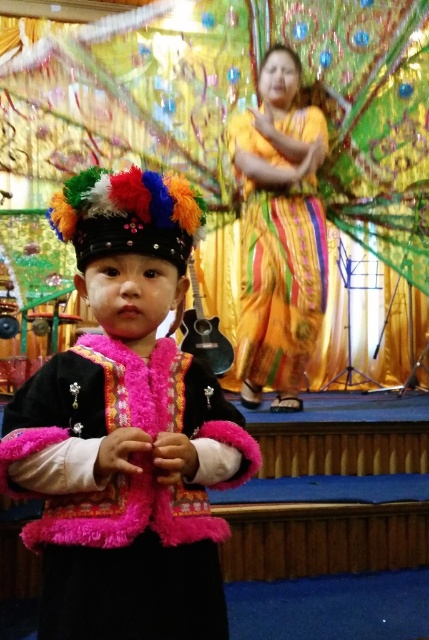
Which is behind, point (157, 424) or point (259, 214)?

The point (259, 214) is behind.

Is fuzzy pink vest at center in front of shiny yellow fabric dress at center?

Yes, it is in front of shiny yellow fabric dress at center.

This screenshot has width=429, height=640. What are the coordinates of `fuzzy pink vest at center` in the screenshot? It's located at (130, 561).